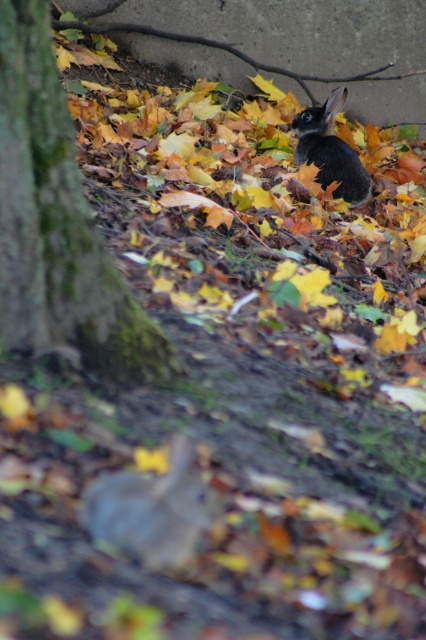
Consider the image. Between fuzzy gray rabbit at lower center and black fur rabbit at center, which one appears on the right side from the viewer's perspective?

black fur rabbit at center

Who is more forward, (190, 483) or (316, 177)?

Positioned in front is point (190, 483).

Between point (160, 492) and point (328, 145), which one is positioned in front?

Point (160, 492) is more forward.

The width and height of the screenshot is (426, 640). I want to click on fuzzy gray rabbit at lower center, so click(152, 509).

Which of these two, green mossy tree trunk at left or fuzzy gray rabbit at lower center, stands taller?

With more height is green mossy tree trunk at left.

Is green mossy tree trunk at left wider than fuzzy gray rabbit at lower center?

Correct, the width of green mossy tree trunk at left exceeds that of fuzzy gray rabbit at lower center.

Is point (23, 291) positioned in front of point (100, 540)?

No, it is behind (100, 540).

Find the location of a particular element. The width and height of the screenshot is (426, 640). green mossy tree trunk at left is located at coordinates (57, 225).

In order to click on green mossy tree trunk at left in this screenshot , I will do `click(57, 225)`.

Does green mossy tree trunk at left have a lesser height compared to black fur rabbit at center?

Incorrect, green mossy tree trunk at left's height does not fall short of black fur rabbit at center's.

Describe the element at coordinates (57, 225) in the screenshot. This screenshot has height=640, width=426. I see `green mossy tree trunk at left` at that location.

Find the location of a particular element. The height and width of the screenshot is (640, 426). green mossy tree trunk at left is located at coordinates (57, 225).